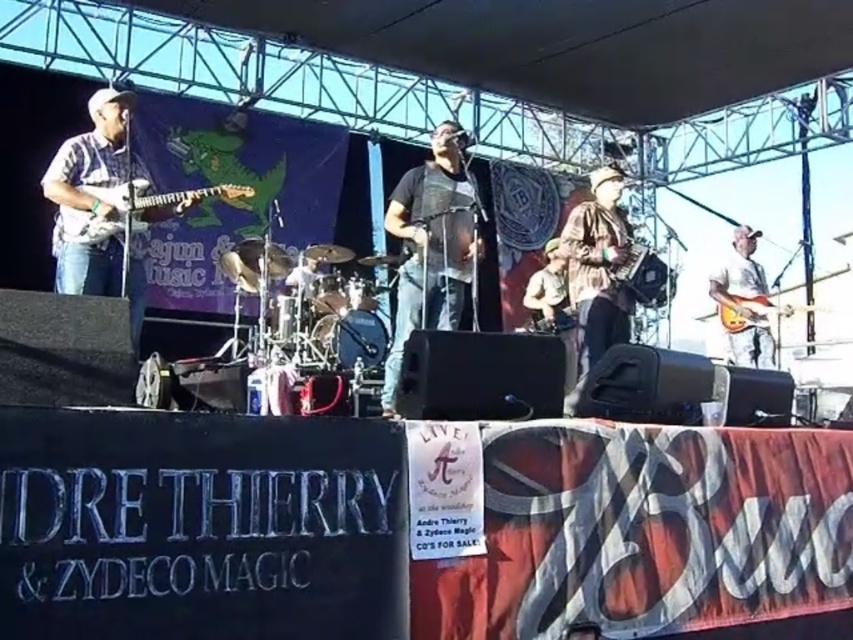
Question: Which object is positioned farthest from the brown leather guitar at center?

Choices:
 (A) light brown wooden guitar at right
 (B) white matte guitar at right

Answer: (A)

Question: Which point appears farthest from the camera in this image?

Choices:
 (A) (619, 323)
 (B) (750, 321)

Answer: (B)

Question: Is camouflage fabric jacket at center closer to the viewer compared to light brown wooden guitar at right?

Choices:
 (A) no
 (B) yes

Answer: (B)

Question: Estimate the real-world distances between objects in this image. Which object is closer to the camouflage fabric jacket at center?

Choices:
 (A) white matte guitar at right
 (B) light brown wooden guitar at right
 (C) black mesh vest at center

Answer: (C)

Question: Does black mesh vest at center have a smaller size compared to white matte guitar at right?

Choices:
 (A) no
 (B) yes

Answer: (B)

Question: Does camouflage fabric jacket at center come behind white matte guitar at right?

Choices:
 (A) no
 (B) yes

Answer: (A)